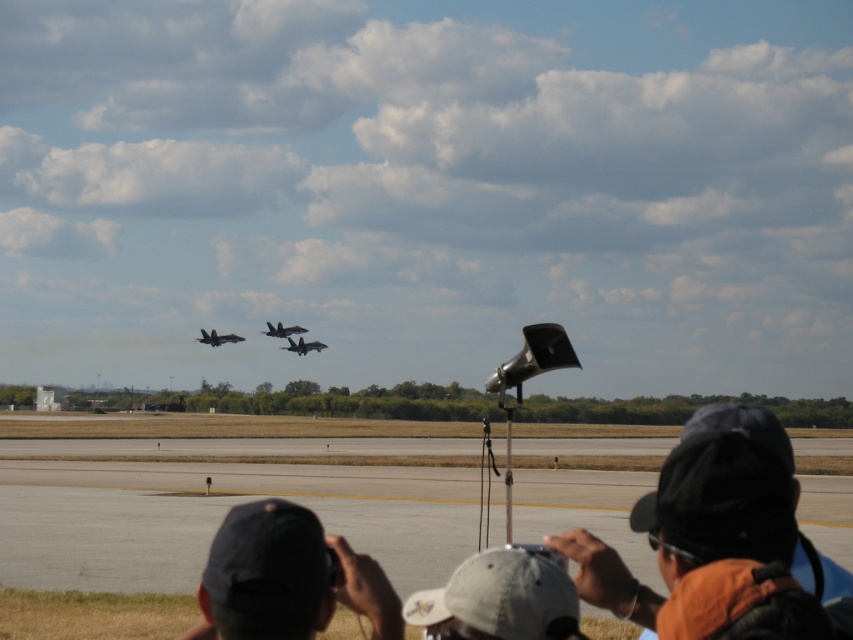
Question: Which point is farther to the camera?

Choices:
 (A) (224, 339)
 (B) (693, 550)
 (C) (450, 621)
 (D) (315, 349)

Answer: (D)

Question: Which is farther from the white fabric cap at lower center?

Choices:
 (A) silver metallic jet at center
 (B) asphalt tarmac at lower center

Answer: (A)

Question: Which of the following is the farthest from the observer?

Choices:
 (A) (253, 588)
 (B) (204, 337)
 (C) (86, 561)

Answer: (B)

Question: Is white fabric cap at lower center wider than silver metallic jet at center?

Choices:
 (A) yes
 (B) no

Answer: (B)

Question: Is white fabric cap at lower center to the right of dark gray metallic jet at upper center from the viewer's perspective?

Choices:
 (A) yes
 (B) no

Answer: (A)

Question: Can you confirm if asphalt tarmac at lower center is positioned to the left of dark gray cap at lower right?

Choices:
 (A) yes
 (B) no

Answer: (A)